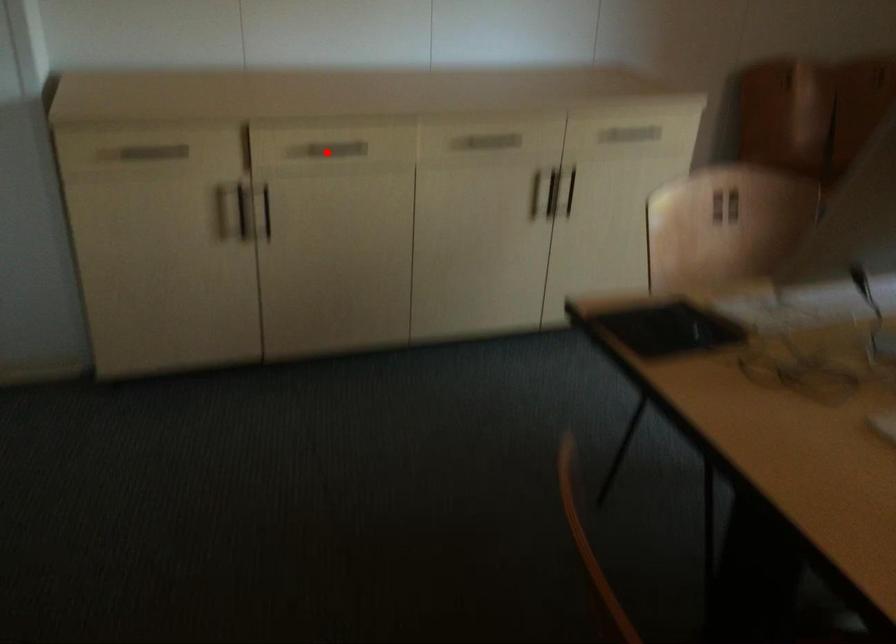
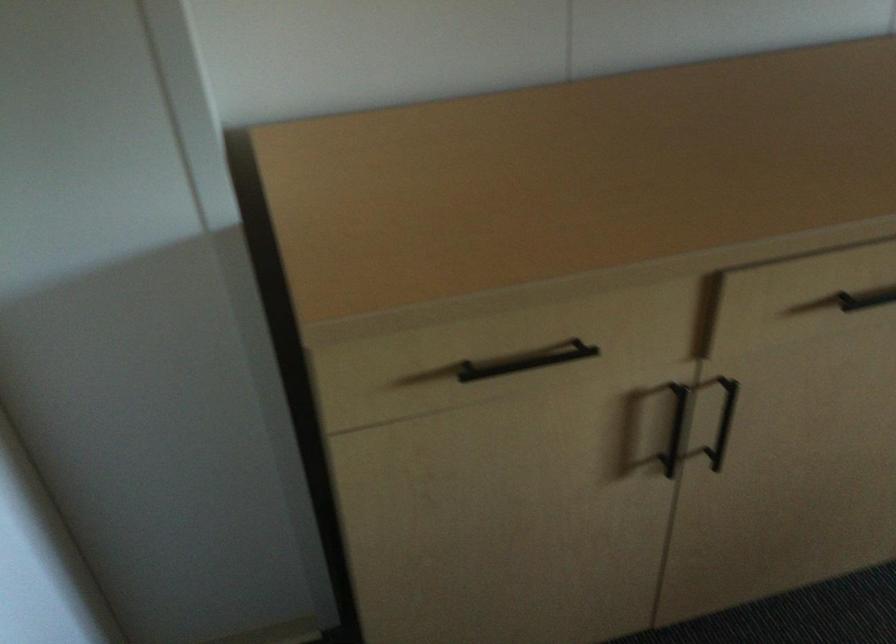
Question: I am providing you with two images of the same scene from different viewpoints. A red point is shown in image1. For the corresponding object point in image2, is it positioned nearer or farther from the camera?

Choices:
 (A) Nearer
 (B) Farther

Answer: (A)